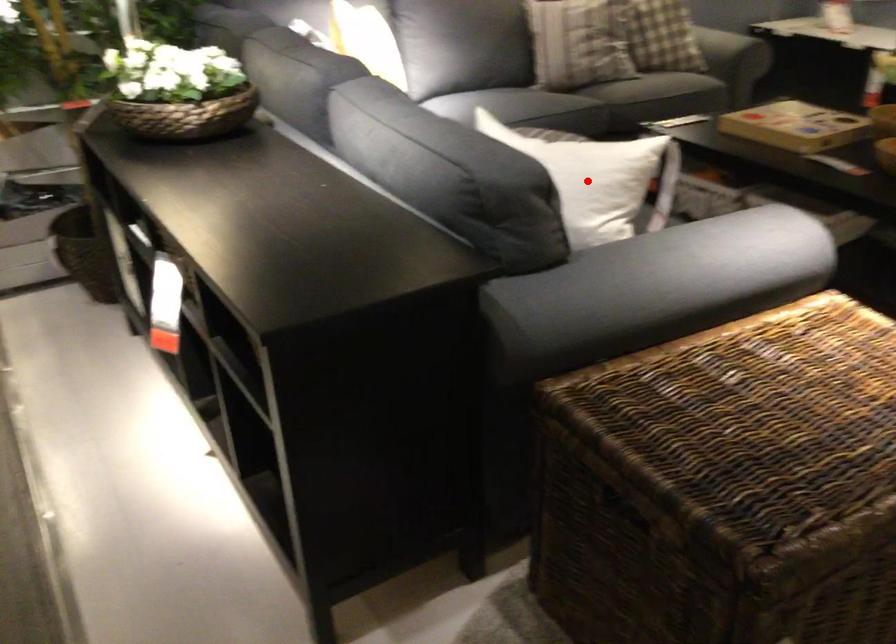
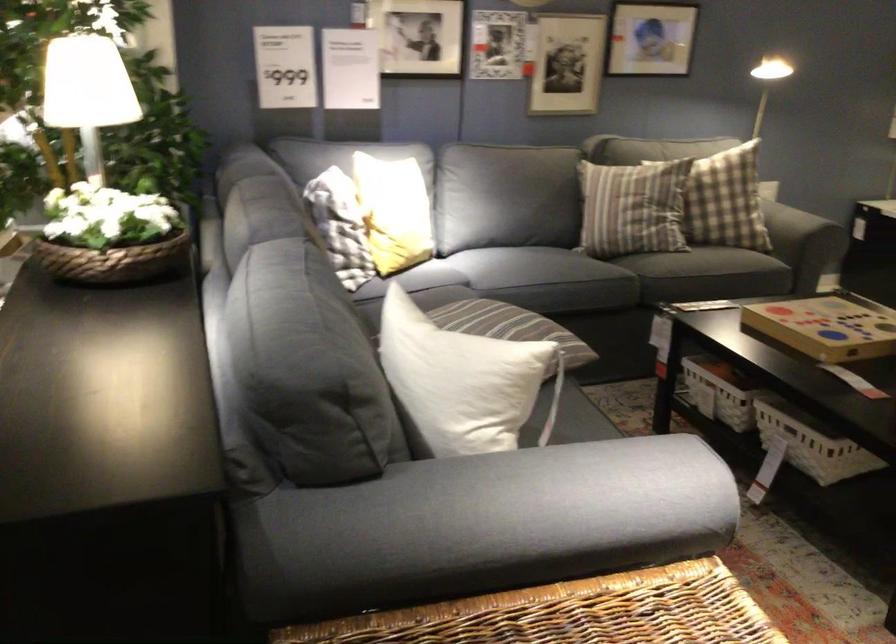
Question: I am providing you with two images of the same scene from different viewpoints. In image1, a red point is highlighted. Considering the same 3D point in image2, which of the following is correct?

Choices:
 (A) It is closer
 (B) It is farther

Answer: (A)